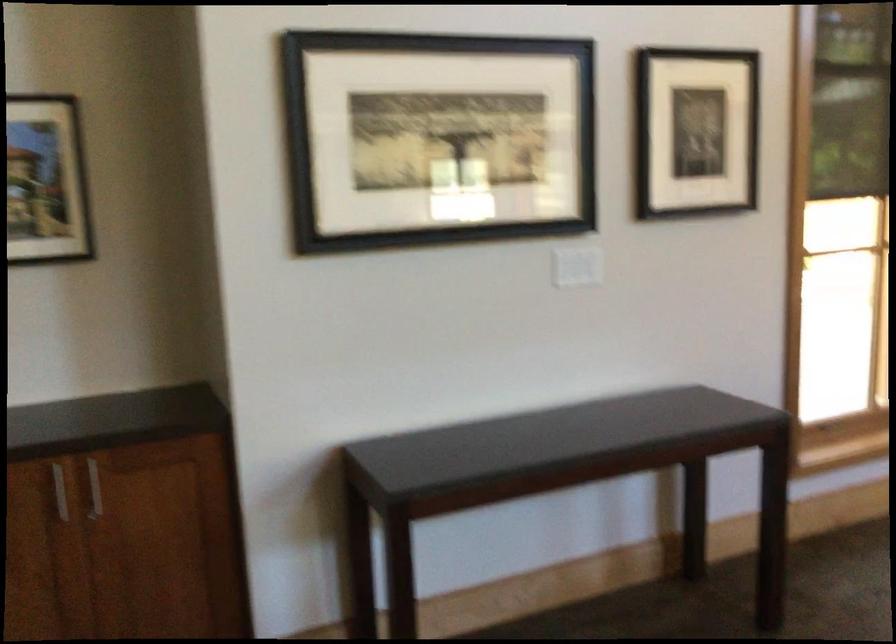
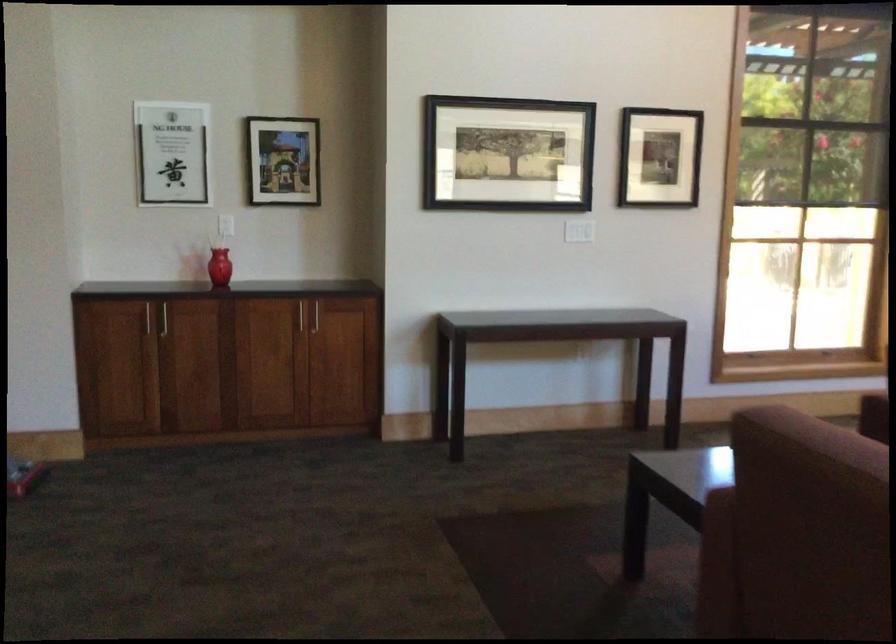
Question: In a continuous first-person perspective shot, in which direction is the camera moving?

Choices:
 (A) Left
 (B) Right
 (C) Forward
 (D) Backward

Answer: (D)